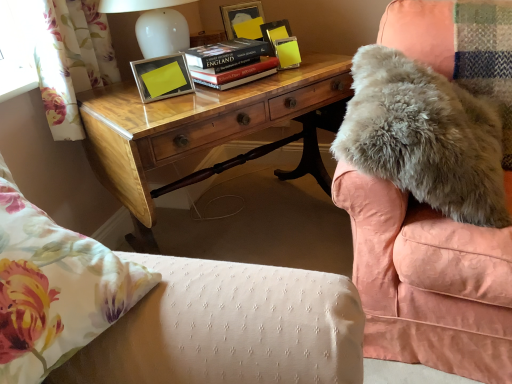
Where is `free space in front of hardcover book at center`? free space in front of hardcover book at center is located at coordinates (238, 96).